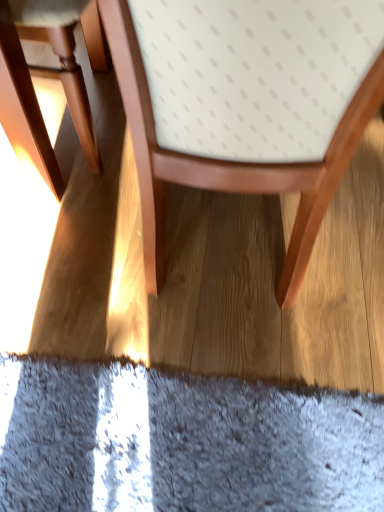
Locate an element on the screen. This screenshot has height=512, width=384. vacant space in front of matte wood chair at left, which is the 1th chair in left-to-right order is located at coordinates (65, 223).